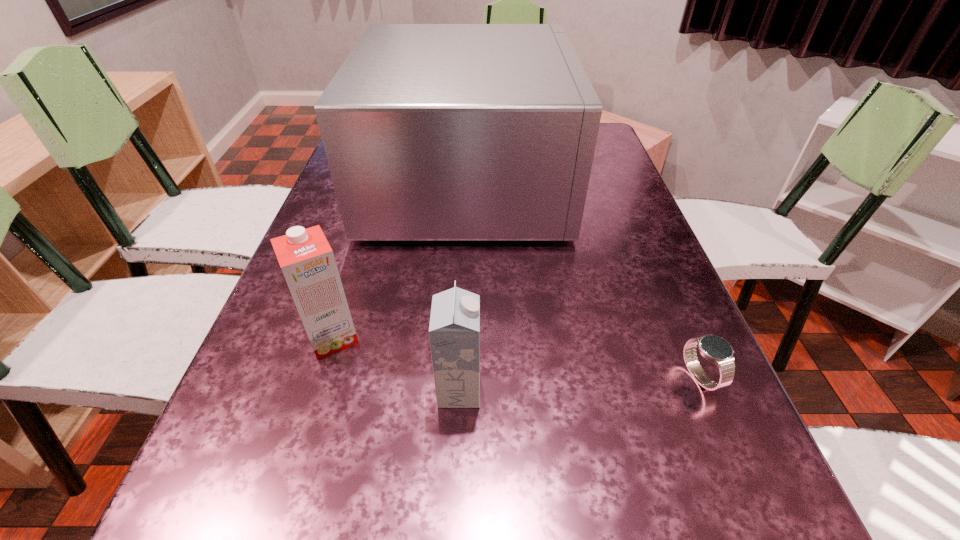
Where is `vacant position in the image that satisfies the following two spatial constraints: 1. on the front side of the rightmost object; 2. on the right side of the left carton`? vacant position in the image that satisfies the following two spatial constraints: 1. on the front side of the rightmost object; 2. on the right side of the left carton is located at coordinates (320, 377).

Locate an element on the screen. The image size is (960, 540). vacant area that satisfies the following two spatial constraints: 1. with the door open on the rightmost object; 2. on the right side of the tallest object is located at coordinates (461, 377).